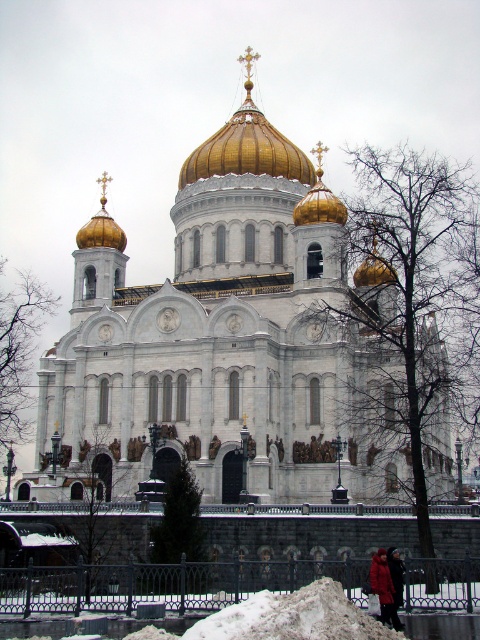
Question: Among these objects, which one is nearest to the camera?

Choices:
 (A) gold polished dome at center
 (B) white marble church at center

Answer: (B)

Question: Can you confirm if white marble church at center is positioned to the left of gold polished dome at center?

Choices:
 (A) yes
 (B) no

Answer: (A)

Question: Which object appears closest to the camera in this image?

Choices:
 (A) white marble church at center
 (B) gold polished dome at center

Answer: (A)

Question: Does white marble church at center appear under gold polished dome at center?

Choices:
 (A) no
 (B) yes

Answer: (B)

Question: Observing the image, what is the correct spatial positioning of white marble church at center in reference to gold polished dome at center?

Choices:
 (A) left
 (B) right

Answer: (A)

Question: Which object appears closest to the camera in this image?

Choices:
 (A) white marble church at center
 (B) gold polished dome at center

Answer: (A)